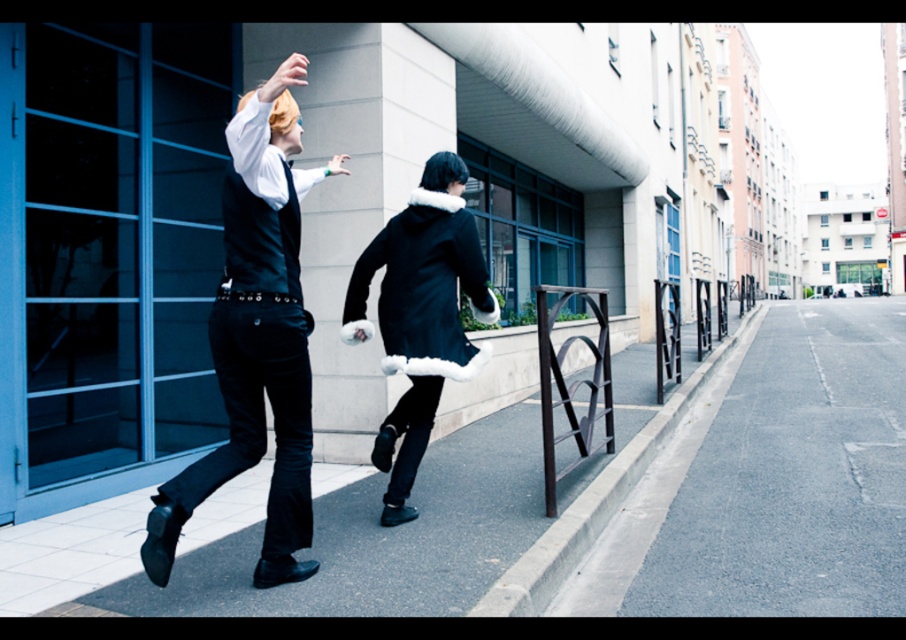
Is point (890, 560) positioned behind point (402, 264)?

No, (890, 560) is closer to viewer.

Is point (795, 572) closer to camera compared to point (463, 257)?

Yes.

Where is `gray asphalt pavement at center`? gray asphalt pavement at center is located at coordinates (770, 481).

This screenshot has height=640, width=906. In order to click on gray asphalt pavement at center in this screenshot , I will do `click(770, 481)`.

From the picture: Is matte black suit at center positioned before black asphalt at center?

Yes.

Is matte black suit at center smaller than black asphalt at center?

Yes.

Between point (258, 179) and point (317, 481), which one is positioned in front?

Point (258, 179) is in front.

The width and height of the screenshot is (906, 640). In order to click on matte black suit at center in this screenshot , I will do `click(257, 337)`.

Who is higher up, velvet black coat at center or black asphalt at center?

velvet black coat at center is higher up.

Is velvet black coat at center further to the viewer compared to black asphalt at center?

Yes, velvet black coat at center is behind black asphalt at center.

In order to click on velvet black coat at center in this screenshot , I will do `click(420, 314)`.

Image resolution: width=906 pixels, height=640 pixels. I want to click on velvet black coat at center, so click(420, 314).